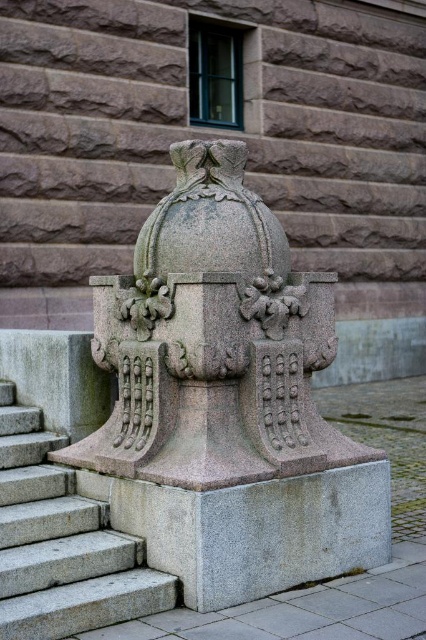
Does point (137, 456) come closer to viewer compared to point (23, 625)?

No.

Does granite sculpture at center have a greater height compared to gray granite stairs at lower left?

Indeed, granite sculpture at center has a greater height compared to gray granite stairs at lower left.

Is point (264, 472) positioned behind point (9, 589)?

Yes.

Find the location of `granite sculpture at center`. granite sculpture at center is located at coordinates (213, 340).